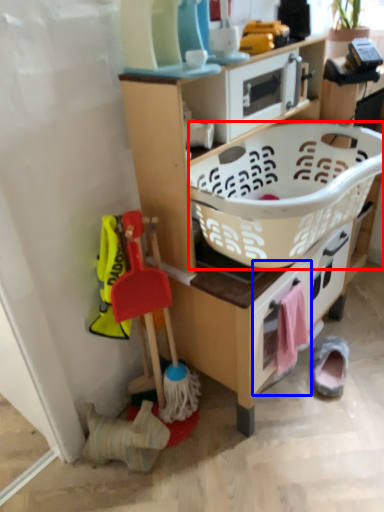
Question: Among these objects, which one is nearest to the camera, basket (highlighted by a red box) or drawer (highlighted by a blue box)?

Choices:
 (A) basket
 (B) drawer

Answer: (A)